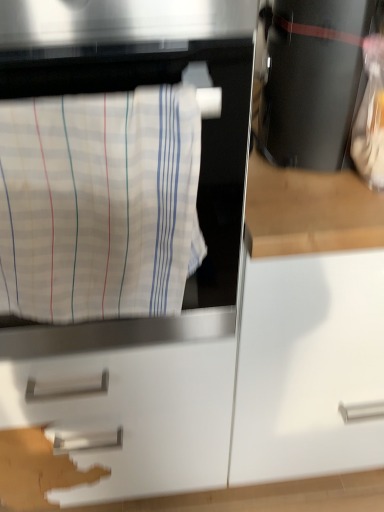
Question: Is white matte drawer at center behind black glossy coffee maker at upper right?

Choices:
 (A) yes
 (B) no

Answer: (A)

Question: Does white matte drawer at center have a larger size compared to black glossy coffee maker at upper right?

Choices:
 (A) no
 (B) yes

Answer: (B)

Question: Is white matte drawer at center at the right side of black glossy coffee maker at upper right?

Choices:
 (A) yes
 (B) no

Answer: (B)

Question: Is white matte drawer at center oriented away from black glossy coffee maker at upper right?

Choices:
 (A) no
 (B) yes

Answer: (A)

Question: Can you confirm if white matte drawer at center is shorter than black glossy coffee maker at upper right?

Choices:
 (A) no
 (B) yes

Answer: (A)

Question: Is point (225, 422) positioned closer to the camera than point (188, 232)?

Choices:
 (A) farther
 (B) closer

Answer: (A)

Question: Is white matte drawer at center to the left or to the right of white striped fabric at left in the image?

Choices:
 (A) left
 (B) right

Answer: (A)

Question: Is white matte drawer at center in front of or behind white striped fabric at left in the image?

Choices:
 (A) behind
 (B) front

Answer: (A)

Question: From the image's perspective, relative to white striped fabric at left, is white matte drawer at center above or below?

Choices:
 (A) below
 (B) above

Answer: (A)

Question: Choose the correct answer: Is white striped fabric at left inside white matte drawer at center or outside it?

Choices:
 (A) outside
 (B) inside

Answer: (A)

Question: From a real-world perspective, is white striped fabric at left physically located above or below white matte drawer at center?

Choices:
 (A) above
 (B) below

Answer: (A)

Question: Is point (64, 316) positioned closer to the camera than point (218, 413)?

Choices:
 (A) farther
 (B) closer

Answer: (B)

Question: Based on their sizes in the image, would you say white striped fabric at left is bigger or smaller than white matte drawer at center?

Choices:
 (A) small
 (B) big

Answer: (A)

Question: Looking at their shapes, would you say white matte drawer at center is wider or thinner than black glossy coffee maker at upper right?

Choices:
 (A) thin
 (B) wide

Answer: (B)

Question: Looking at the image, does white matte drawer at center seem bigger or smaller compared to black glossy coffee maker at upper right?

Choices:
 (A) big
 (B) small

Answer: (A)